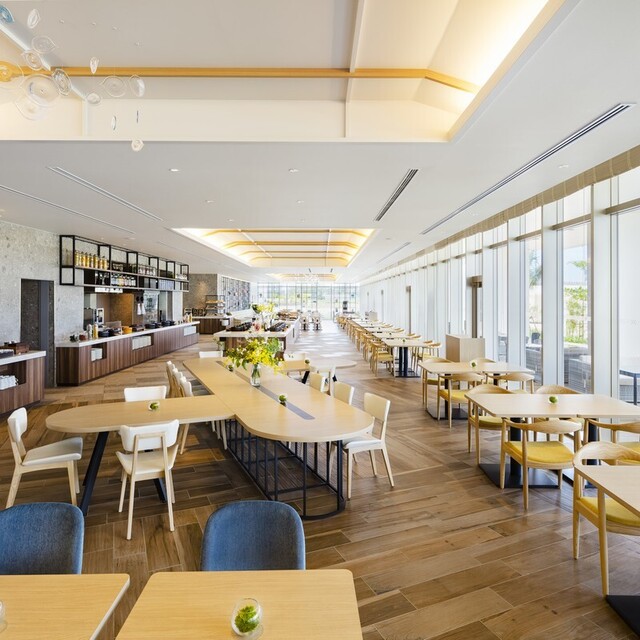
Where is `tables by the windows`? tables by the windows is located at coordinates (608, 491), (550, 404), (482, 364), (409, 346), (392, 330), (380, 324), (371, 320).